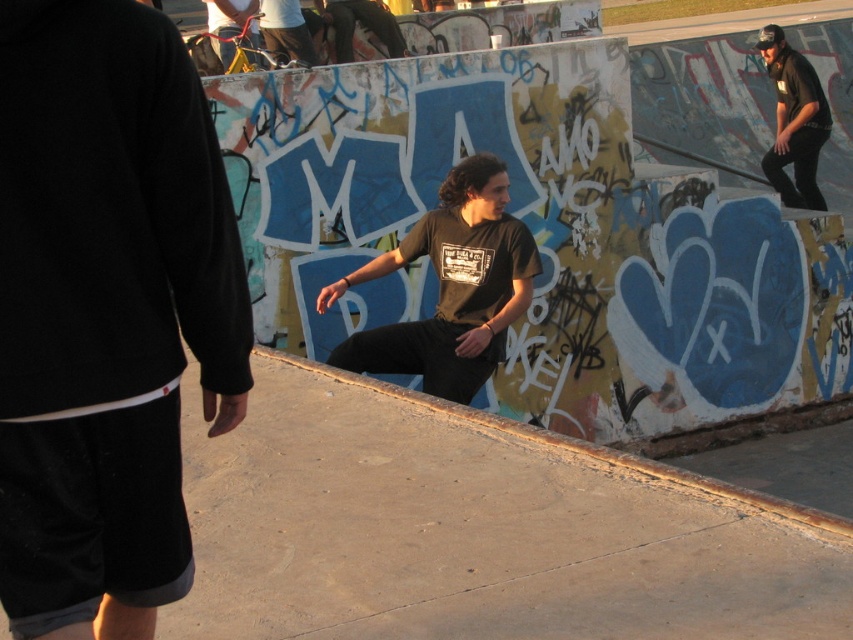
Question: Can you confirm if black matte t-shirt at center is positioned above black matte pants at upper right?

Choices:
 (A) no
 (B) yes

Answer: (A)

Question: Based on their relative distances, which object is nearer to the black matte t-shirt at center?

Choices:
 (A) black matte shorts at lower left
 (B) black matte pants at upper right

Answer: (A)

Question: Can you confirm if black matte shorts at lower left is bigger than black matte pants at upper right?

Choices:
 (A) no
 (B) yes

Answer: (A)

Question: Which of the following is the farthest from the observer?

Choices:
 (A) (148, 83)
 (B) (782, 68)
 (C) (461, 333)

Answer: (B)

Question: Is black matte t-shirt at center smaller than black matte pants at upper right?

Choices:
 (A) no
 (B) yes

Answer: (B)

Question: Which object is the farthest from the black matte shorts at lower left?

Choices:
 (A) black matte t-shirt at center
 (B) black matte pants at upper right

Answer: (B)